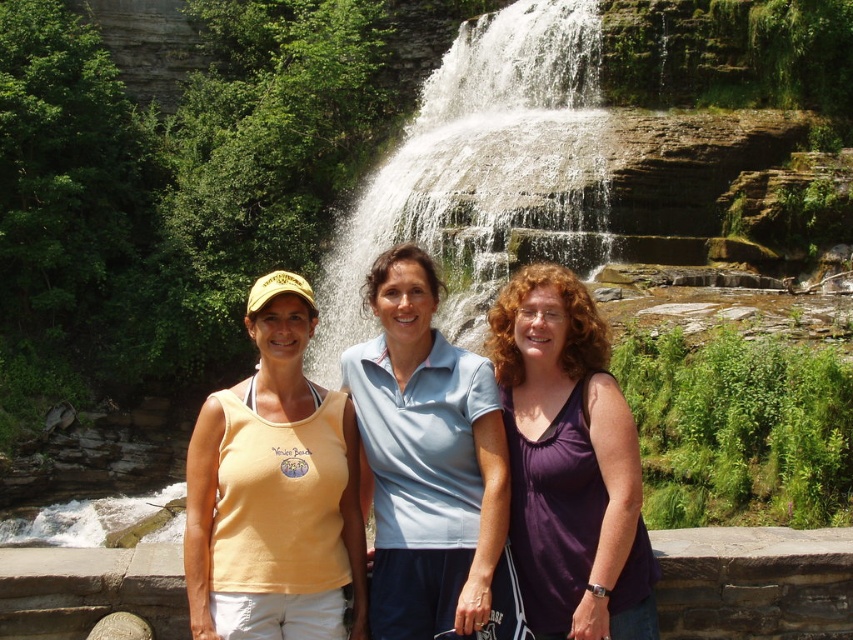
Question: Among these points, which one is nearest to the camera?

Choices:
 (A) (531, 148)
 (B) (375, 582)
 (C) (630, 515)

Answer: (C)

Question: Is white textured water at center closer to camera compared to light blue cotton polo shirt at center?

Choices:
 (A) no
 (B) yes

Answer: (A)

Question: Which point appears farthest from the camera in this image?

Choices:
 (A) (650, 627)
 (B) (268, 342)

Answer: (B)

Question: Is yellow sleeveless shirt at center to the left of light blue cotton polo shirt at center from the viewer's perspective?

Choices:
 (A) no
 (B) yes

Answer: (B)

Question: Is white textured water at center behind light blue cotton polo shirt at center?

Choices:
 (A) yes
 (B) no

Answer: (A)

Question: Based on their relative distances, which object is farther from the white textured water at center?

Choices:
 (A) light blue cotton polo shirt at center
 (B) purple matte tank top at center

Answer: (A)